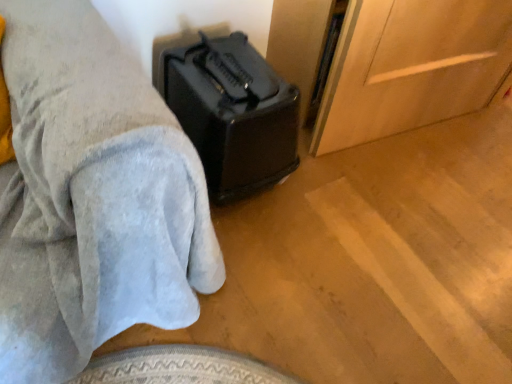
Describe the element at coordinates (92, 197) in the screenshot. I see `black plastic speaker at lower left` at that location.

Consider the image. What is the approximate width of black plastic speaker at lower left?

black plastic speaker at lower left is 80.74 centimeters in width.

Identify the location of black plastic speaker at lower left. (92, 197).

Where is `black plastic suitcase at center`? black plastic suitcase at center is located at coordinates (233, 113).

This screenshot has height=384, width=512. What do you see at coordinates (233, 113) in the screenshot?
I see `black plastic suitcase at center` at bounding box center [233, 113].

The width and height of the screenshot is (512, 384). Identify the location of black plastic speaker at lower left. (92, 197).

Can you confirm if black plastic speaker at lower left is positioned to the right of black plastic suitcase at center?

In fact, black plastic speaker at lower left is to the left of black plastic suitcase at center.

Considering the positions of objects black plastic speaker at lower left and black plastic suitcase at center in the image provided, who is behind, black plastic speaker at lower left or black plastic suitcase at center?

black plastic suitcase at center is further from the camera.

Between point (49, 272) and point (265, 96), which one is positioned in front?

Positioned in front is point (49, 272).

Based on the photo, from the image's perspective, between black plastic speaker at lower left and black plastic suitcase at center, who is located below?

black plastic speaker at lower left appears lower in the image.

From the picture: From a real-world perspective, is black plastic speaker at lower left above or below black plastic suitcase at center?

In terms of real-world spatial position, black plastic speaker at lower left is above black plastic suitcase at center.

In terms of width, does black plastic speaker at lower left look wider or thinner when compared to black plastic suitcase at center?

Considering their sizes, black plastic speaker at lower left looks broader than black plastic suitcase at center.

Can you confirm if black plastic speaker at lower left is shorter than black plastic suitcase at center?

No, black plastic speaker at lower left is not shorter than black plastic suitcase at center.

Is black plastic speaker at lower left smaller than black plastic suitcase at center?

No.

Is black plastic speaker at lower left not within black plastic suitcase at center?

black plastic speaker at lower left lies outside black plastic suitcase at center's area.

Is black plastic speaker at lower left with black plastic suitcase at center?

No, black plastic speaker at lower left is not making contact with black plastic suitcase at center.

Is black plastic speaker at lower left oriented away from black plastic suitcase at center?

No.

In the scene shown: Measure the distance from black plastic speaker at lower left to black plastic suitcase at center.

16.33 inches.

Where is `luggage behind the black plastic speaker at lower left`? luggage behind the black plastic speaker at lower left is located at coordinates (233, 113).

In the image, is black plastic suitcase at center on the left side or the right side of black plastic speaker at lower left?

Clearly, black plastic suitcase at center is on the right of black plastic speaker at lower left in the image.

In the image, is black plastic suitcase at center positioned in front of or behind black plastic speaker at lower left?

In the image, black plastic suitcase at center appears behind black plastic speaker at lower left.

Between point (187, 112) and point (91, 27), which one is positioned behind?

Point (187, 112)

From the image's perspective, is black plastic suitcase at center above or below black plastic speaker at lower left?

Clearly, from the image's perspective, black plastic suitcase at center is above black plastic speaker at lower left.

From a real-world perspective, is black plastic suitcase at center above or below black plastic speaker at lower left?

black plastic suitcase at center is situated lower than black plastic speaker at lower left in the real world.

In terms of width, does black plastic suitcase at center look wider or thinner when compared to black plastic speaker at lower left?

black plastic suitcase at center is thinner than black plastic speaker at lower left.

Which of these two, black plastic suitcase at center or black plastic speaker at lower left, stands shorter?

With less height is black plastic suitcase at center.

Based on their sizes in the image, would you say black plastic suitcase at center is bigger or smaller than black plastic speaker at lower left?

Considering their sizes, black plastic suitcase at center takes up less space than black plastic speaker at lower left.

Is black plastic speaker at lower left surrounded by black plastic suitcase at center?

No, black plastic speaker at lower left is located outside of black plastic suitcase at center.

Is black plastic suitcase at center far away from black plastic speaker at lower left?

No, black plastic suitcase at center is not far away from black plastic speaker at lower left.

Is black plastic suitcase at center oriented towards black plastic speaker at lower left?

No, black plastic suitcase at center is not facing towards black plastic speaker at lower left.

How far apart are black plastic suitcase at center and black plastic speaker at lower left?

They are 16.33 inches apart.

In order to click on luggage above the black plastic speaker at lower left (from the image's perspective) in this screenshot , I will do `click(233, 113)`.

Locate an element on the screen. The image size is (512, 384). luggage below the black plastic speaker at lower left (from a real-world perspective) is located at coordinates pos(233,113).

You are a GUI agent. You are given a task and a screenshot of the screen. Output one action in this format:
    pyautogui.click(x=<x>, y=<y>)
    Task: Click on the furniture below the black plastic suitcase at center (from the image's perspective)
    
    Given the screenshot: What is the action you would take?
    pyautogui.click(x=92, y=197)